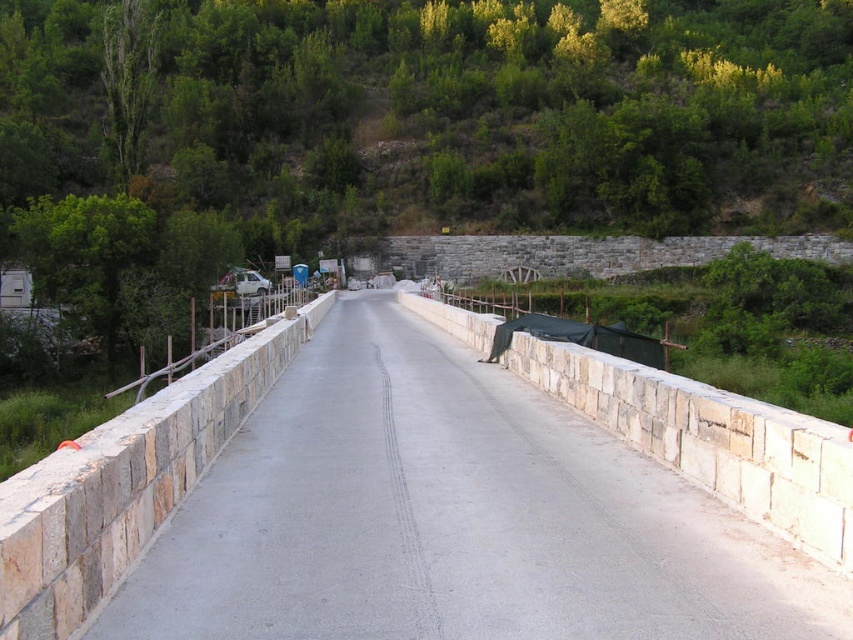
Does green leafy tree at center have a greater width compared to natural stone wall at left?

Yes, green leafy tree at center is wider than natural stone wall at left.

Locate an element on the screen. Image resolution: width=853 pixels, height=640 pixels. green leafy tree at center is located at coordinates (421, 120).

What are the coordinates of `green leafy tree at center` in the screenshot? It's located at (421, 120).

Can you confirm if green leafy tree at center is wider than white stone wall at center?

Yes, green leafy tree at center is wider than white stone wall at center.

Who is shorter, green leafy tree at center or white stone wall at center?

white stone wall at center

Looking at this image, who is more forward, (149, 108) or (709, 428)?

Positioned in front is point (709, 428).

Locate an element on the screen. The image size is (853, 640). green leafy tree at center is located at coordinates (421, 120).

Based on the photo, who is lower down, smooth concrete highway at center or white stone wall at center?

smooth concrete highway at center is below.

Between smooth concrete highway at center and white stone wall at center, which one appears on the left side from the viewer's perspective?

Positioned to the left is smooth concrete highway at center.

Does point (795, 577) come behind point (730, 458)?

No.

Identify the location of smooth concrete highway at center. (451, 516).